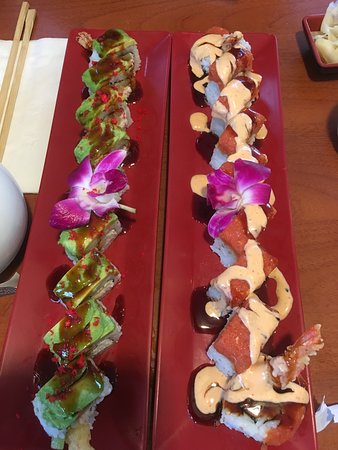
Where is `right tray`? The width and height of the screenshot is (338, 450). right tray is located at coordinates (184, 232).